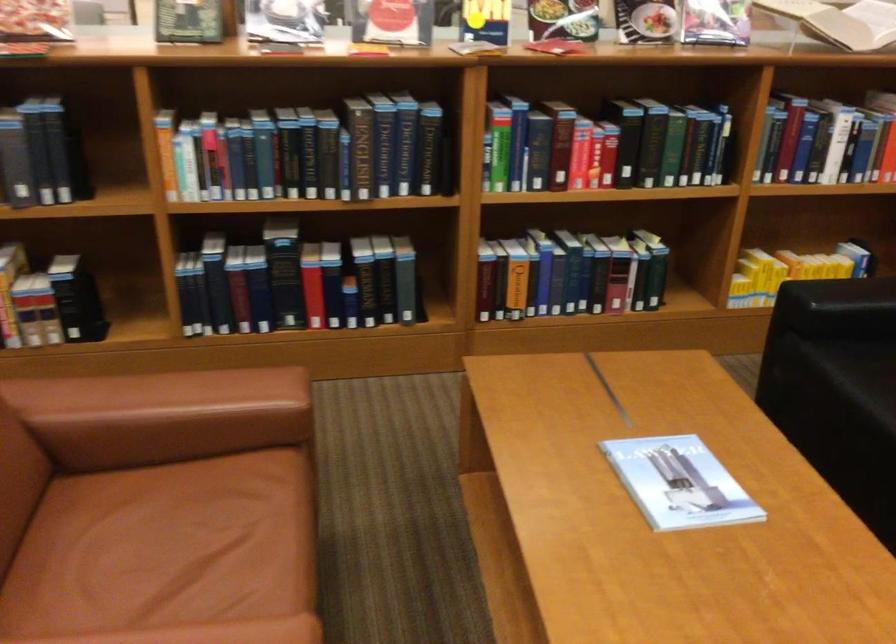
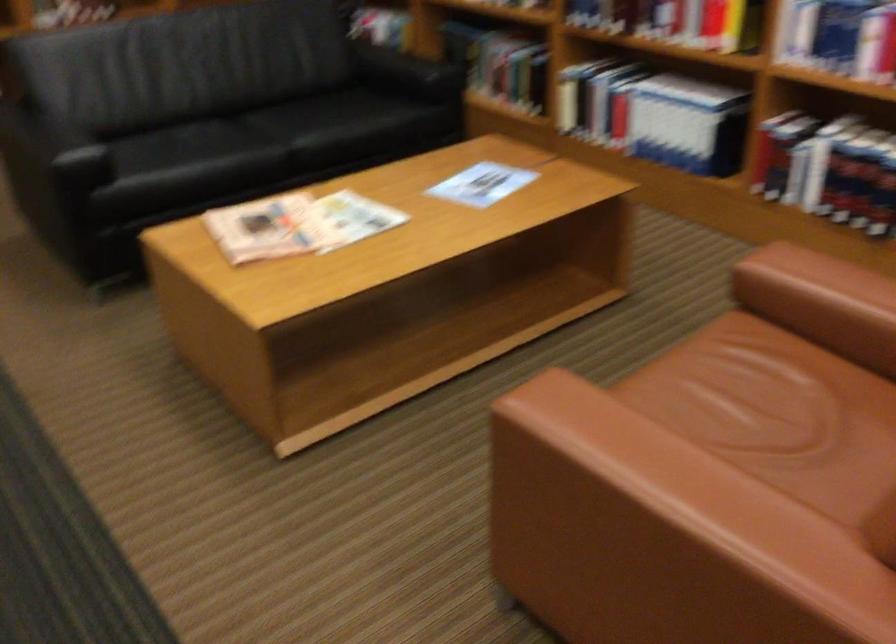
How did the camera likely rotate?

The rotation direction of the camera is left-down.